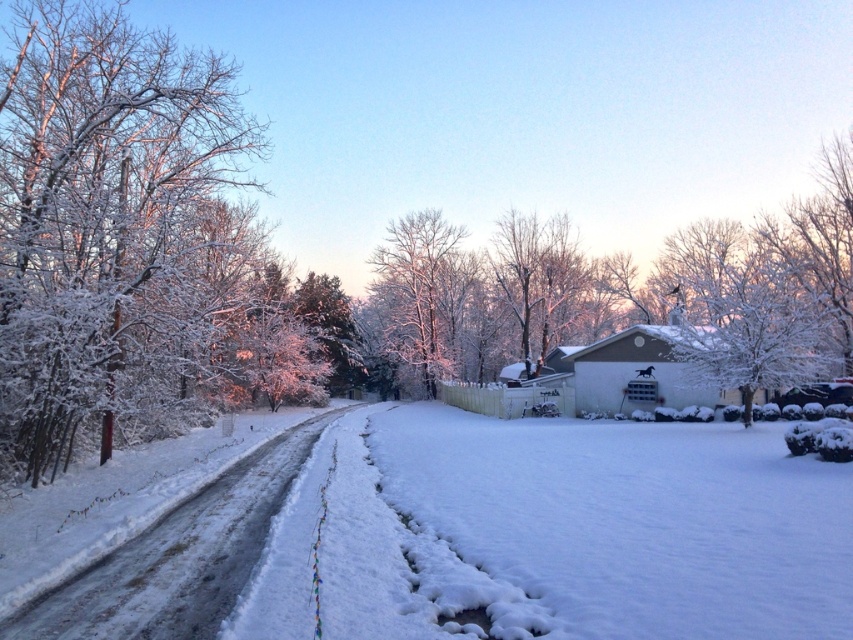
Question: Among these objects, which one is farthest from the camera?

Choices:
 (A) glistening snow-covered evergreen at center
 (B) white frosty tree at center

Answer: (B)

Question: In this image, where is white frosty tree at center located relative to glistening snow-covered evergreen at center?

Choices:
 (A) left
 (B) right

Answer: (B)

Question: Which point is farther from the camera taking this photo?

Choices:
 (A) (312, 300)
 (B) (450, 356)
 (C) (149, 321)

Answer: (B)

Question: Is white frosty branches at left below glistening snow-covered evergreen at center?

Choices:
 (A) no
 (B) yes

Answer: (A)

Question: Considering the relative positions of white fluffy snow at center and white frosty branches at left in the image provided, where is white fluffy snow at center located with respect to white frosty branches at left?

Choices:
 (A) below
 (B) above

Answer: (A)

Question: Among these objects, which one is nearest to the camera?

Choices:
 (A) white frosty tree at center
 (B) glistening snow-covered evergreen at center
 (C) white frosty branches at left

Answer: (C)